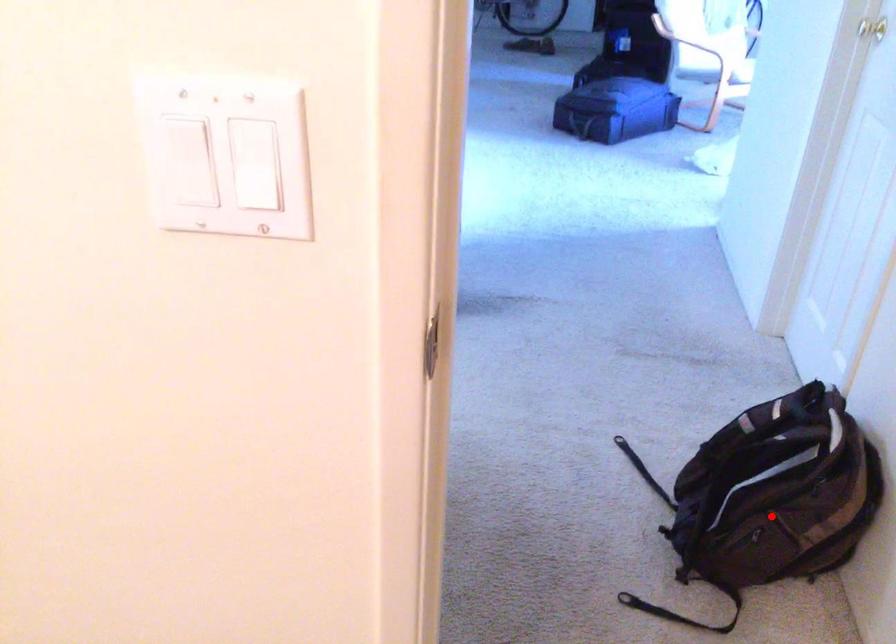
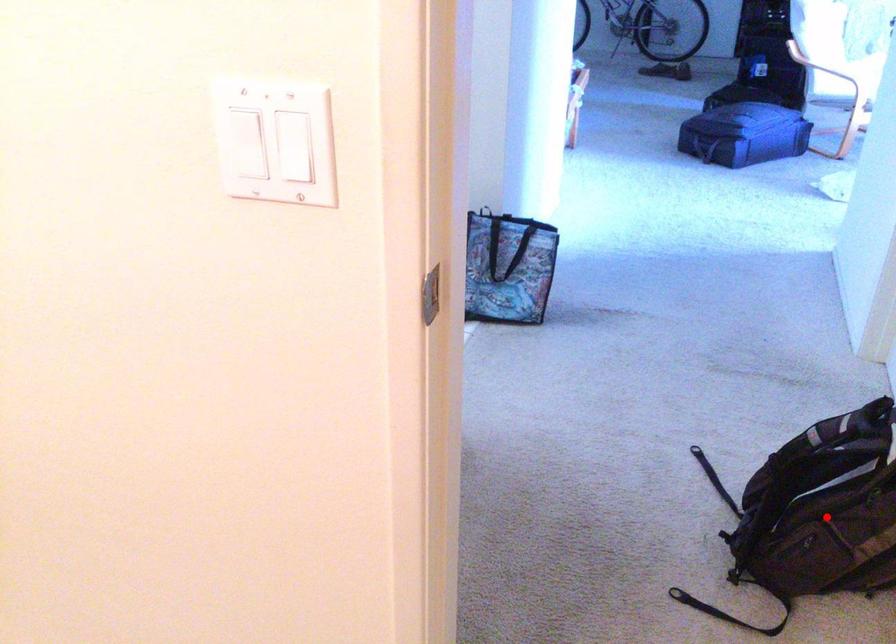
I am providing you with two images of the same scene from different viewpoints. A red point is marked on the first image and another point is marked on the second image. Is the marked point in image1 the same physical position as the marked point in image2?

Yes